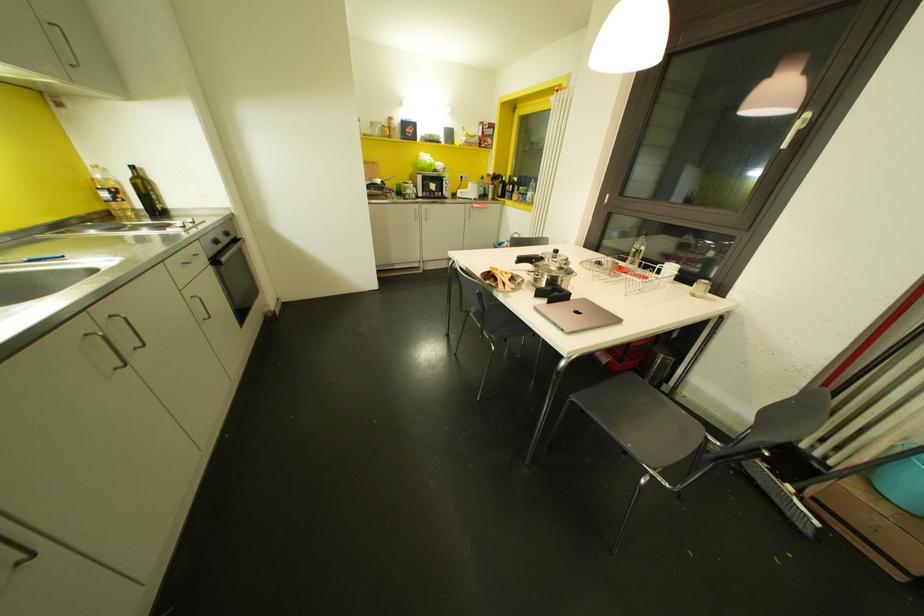
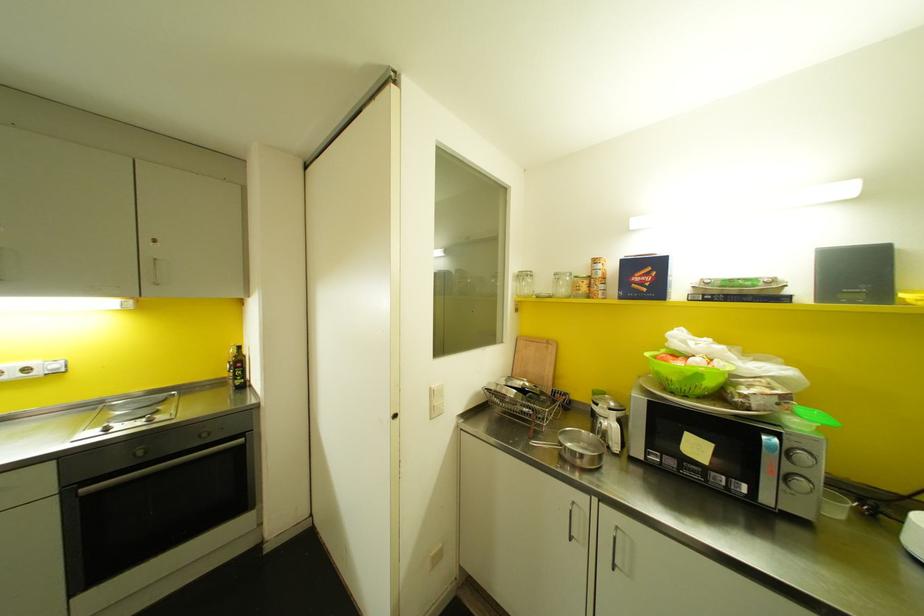
The point at (377, 132) is marked in the first image. Where is the corresponding point in the second image?

(562, 290)